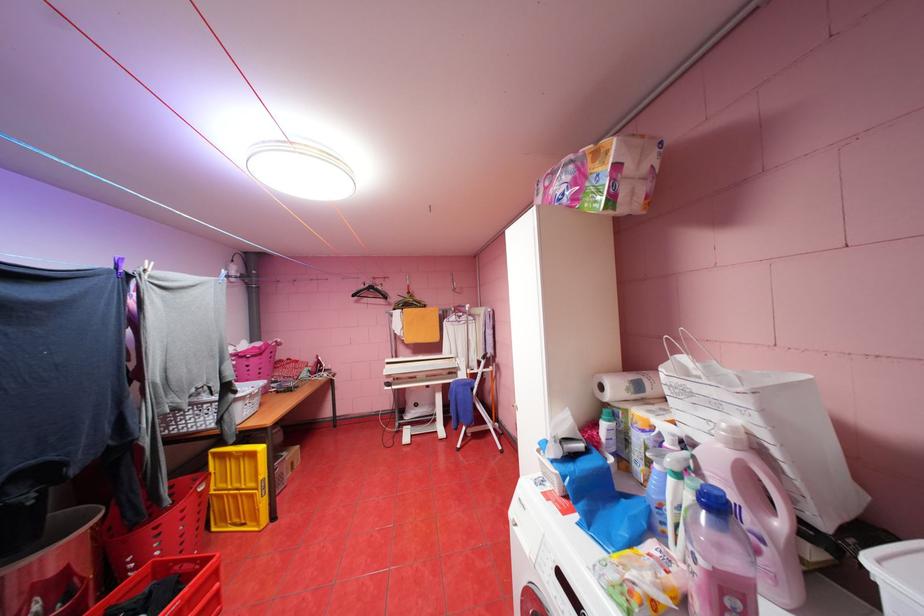
Where is `ironing press handle`? The height and width of the screenshot is (616, 924). ironing press handle is located at coordinates (419, 373).